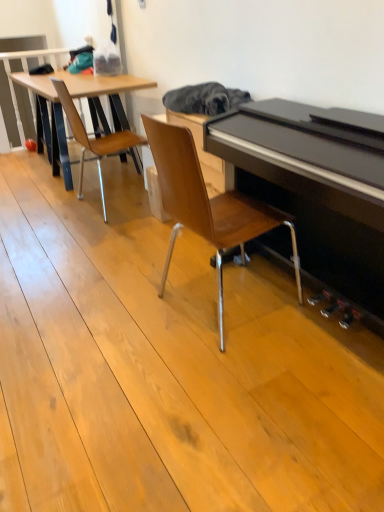
Image resolution: width=384 pixels, height=512 pixels. Identify the location of vacant space to the left of wooden chair at left, which is the first chair from left to right. (37, 205).